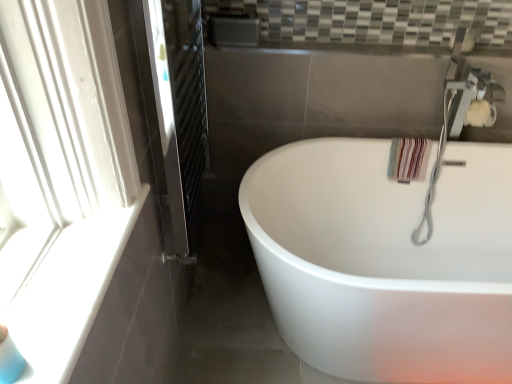
What do you see at coordinates (459, 126) in the screenshot? This screenshot has width=512, height=384. I see `silver metallic faucet at upper right` at bounding box center [459, 126].

The height and width of the screenshot is (384, 512). In order to click on clear glass screen door at left in this screenshot , I will do `click(177, 118)`.

This screenshot has height=384, width=512. What are the coordinates of `white glossy bathtub at center` in the screenshot? It's located at (385, 261).

Considering the positions of points (477, 95) and (185, 262), is point (477, 95) closer to camera compared to point (185, 262)?

That is False.

From the image's perspective, does silver metallic faucet at upper right appear lower than clear glass screen door at left?

Correct, silver metallic faucet at upper right appears lower than clear glass screen door at left in the image.

Is silver metallic faucet at upper right thinner than clear glass screen door at left?

Incorrect, the width of silver metallic faucet at upper right is not less than that of clear glass screen door at left.

Is silver metallic faucet at upper right oriented towards clear glass screen door at left?

No, silver metallic faucet at upper right is not oriented towards clear glass screen door at left.

Between clear glass screen door at left and white glossy bathtub at center, which one has smaller width?

With smaller width is clear glass screen door at left.

From the image's perspective, is clear glass screen door at left located above or below white glossy bathtub at center?

Clearly, from the image's perspective, clear glass screen door at left is above white glossy bathtub at center.

Considering the sizes of clear glass screen door at left and white glossy bathtub at center in the image, is clear glass screen door at left bigger or smaller than white glossy bathtub at center?

Clearly, clear glass screen door at left is smaller in size than white glossy bathtub at center.

The width and height of the screenshot is (512, 384). I want to click on screen door located on the left of white glossy bathtub at center, so click(x=177, y=118).

Consider the image. Is white glossy bathtub at center at the right side of clear glass screen door at left?

Yes.

Which of these two, white glossy bathtub at center or clear glass screen door at left, is wider?

Wider between the two is white glossy bathtub at center.

From their relative heights in the image, would you say white glossy bathtub at center is taller or shorter than clear glass screen door at left?

In the image, white glossy bathtub at center appears to be shorter than clear glass screen door at left.

Looking at this image, from the image's perspective, is white glossy bathtub at center located above or below clear glass screen door at left?

white glossy bathtub at center is situated lower than clear glass screen door at left in the image.

Is the depth of white glossy bathtub at center greater than that of silver metallic faucet at upper right?

That is False.

Would you say white glossy bathtub at center is outside silver metallic faucet at upper right?

Indeed, white glossy bathtub at center is completely outside silver metallic faucet at upper right.

From a real-world perspective, which is physically above, white glossy bathtub at center or silver metallic faucet at upper right?

silver metallic faucet at upper right is physically above.

Considering the points (455, 369) and (495, 106), which point is behind, point (455, 369) or point (495, 106)?

The point (495, 106) is farther from the camera.

Looking at this image, between clear glass screen door at left and silver metallic faucet at upper right, which one has smaller width?

clear glass screen door at left.

Is point (188, 125) positioned before point (440, 162)?

That is True.

Considering the relative sizes of clear glass screen door at left and silver metallic faucet at upper right in the image provided, is clear glass screen door at left taller than silver metallic faucet at upper right?

Yes.

Is clear glass screen door at left touching silver metallic faucet at upper right?

No, clear glass screen door at left is not making contact with silver metallic faucet at upper right.

Considering the sizes of objects silver metallic faucet at upper right and white glossy bathtub at center in the image provided, who is bigger, silver metallic faucet at upper right or white glossy bathtub at center?

Bigger between the two is white glossy bathtub at center.

Does silver metallic faucet at upper right have a lesser width compared to white glossy bathtub at center?

Indeed, silver metallic faucet at upper right has a lesser width compared to white glossy bathtub at center.

Considering the relative sizes of silver metallic faucet at upper right and white glossy bathtub at center in the image provided, is silver metallic faucet at upper right taller than white glossy bathtub at center?

Yes, silver metallic faucet at upper right is taller than white glossy bathtub at center.

Based on their positions, is silver metallic faucet at upper right located to the left or right of white glossy bathtub at center?

silver metallic faucet at upper right is to the right of white glossy bathtub at center.

You are a GUI agent. You are given a task and a screenshot of the screen. Output one action in this format:
    pyautogui.click(x=<x>, y=<y>)
    Task: Click on the screen door that appears on the left of silver metallic faucet at upper right
    The image size is (512, 384).
    Given the screenshot: What is the action you would take?
    pyautogui.click(x=177, y=118)

You are a GUI agent. You are given a task and a screenshot of the screen. Output one action in this format:
    pyautogui.click(x=<x>, y=<y>)
    Task: Click on the screen door that is above the white glossy bathtub at center (from the image's perspective)
    
    Given the screenshot: What is the action you would take?
    pyautogui.click(x=177, y=118)

Looking at the image, which one is located further to clear glass screen door at left, silver metallic faucet at upper right or white glossy bathtub at center?

silver metallic faucet at upper right lies further to clear glass screen door at left than the other object.

Estimate the real-world distances between objects in this image. Which object is closer to white glossy bathtub at center, clear glass screen door at left or silver metallic faucet at upper right?

silver metallic faucet at upper right is closer to white glossy bathtub at center.

When comparing their distances from white glossy bathtub at center, does silver metallic faucet at upper right or clear glass screen door at left seem further?

clear glass screen door at left is further to white glossy bathtub at center.

From the picture: Which object lies further to the anchor point silver metallic faucet at upper right, clear glass screen door at left or white glossy bathtub at center?

Based on the image, clear glass screen door at left appears to be further to silver metallic faucet at upper right.

Estimate the real-world distances between objects in this image. Which object is further from silver metallic faucet at upper right, white glossy bathtub at center or clear glass screen door at left?

Among the two, clear glass screen door at left is located further to silver metallic faucet at upper right.

Which object lies further to the anchor point clear glass screen door at left, white glossy bathtub at center or silver metallic faucet at upper right?

Based on the image, silver metallic faucet at upper right appears to be further to clear glass screen door at left.

Find the location of a particular element. bathtub between clear glass screen door at left and silver metallic faucet at upper right from left to right is located at coordinates (385, 261).